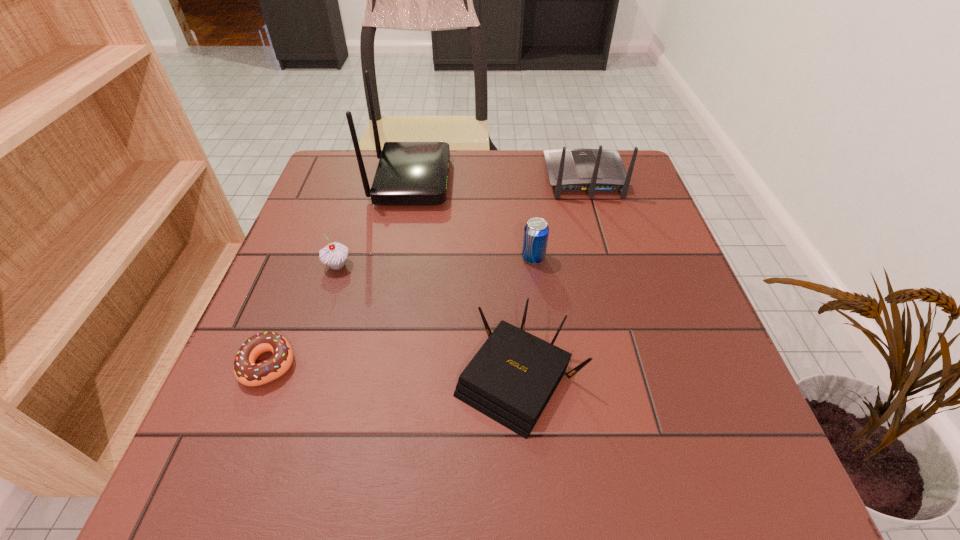
You are a GUI agent. You are given a task and a screenshot of the screen. Output one action in this format:
    pyautogui.click(x=<x>, y=<y>)
    Task: Click on the vacant region located 0.240m on the right of the beer can
    This screenshot has width=960, height=540.
    Given the screenshot: What is the action you would take?
    pyautogui.click(x=654, y=258)

At what (x,y) coordinates should I click in order to perform the action: click on blank area located 0.240m on the right of the cupcake. Please return your answer as a coordinate pair (x, y). The height and width of the screenshot is (540, 960). Looking at the image, I should click on (462, 265).

The height and width of the screenshot is (540, 960). In order to click on vacant space located 0.220m on the left of the shortest router in this screenshot , I will do `click(326, 379)`.

Find the location of `free space located 0.120m on the right of the doughnut`. free space located 0.120m on the right of the doughnut is located at coordinates (364, 364).

Locate an element on the screen. The width and height of the screenshot is (960, 540). router at the left edge is located at coordinates (409, 173).

Locate an element on the screen. This screenshot has width=960, height=540. cupcake present at the left edge is located at coordinates (334, 254).

Image resolution: width=960 pixels, height=540 pixels. I want to click on doughnut that is at the left edge, so click(248, 373).

Locate an element on the screen. The image size is (960, 540). object that is positioned at the right edge is located at coordinates (570, 170).

Identify the location of object that is at the far left corner. (409, 173).

The image size is (960, 540). Identify the location of object present at the far right corner. (570, 170).